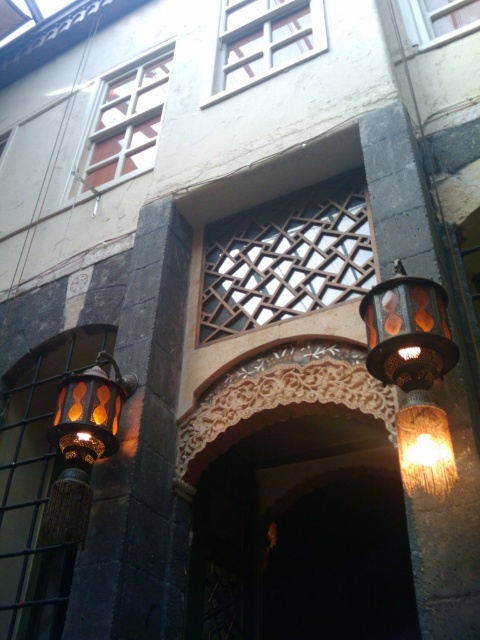
Question: Which of the following is the farthest from the observer?

Choices:
 (A) clear glass window at upper center
 (B) clear glass window at upper right
 (C) matte bronze lantern at left
 (D) wooden lattice at center

Answer: (A)

Question: Is white lattice window at upper left further to the viewer compared to clear glass window at upper center?

Choices:
 (A) no
 (B) yes

Answer: (B)

Question: Is clear glass window at upper center bigger than clear glass window at upper right?

Choices:
 (A) no
 (B) yes

Answer: (B)

Question: Can you confirm if matte bronze lantern at upper right is positioned to the right of matte bronze lantern at left?

Choices:
 (A) no
 (B) yes

Answer: (B)

Question: Which point is closer to the camera?

Choices:
 (A) (324, 618)
 (B) (316, 221)

Answer: (B)

Question: Which object appears closest to the camera in this image?

Choices:
 (A) wooden lattice at center
 (B) matte bronze lantern at upper right
 (C) matte bronze lantern at left
 (D) clear glass window at upper center

Answer: (B)